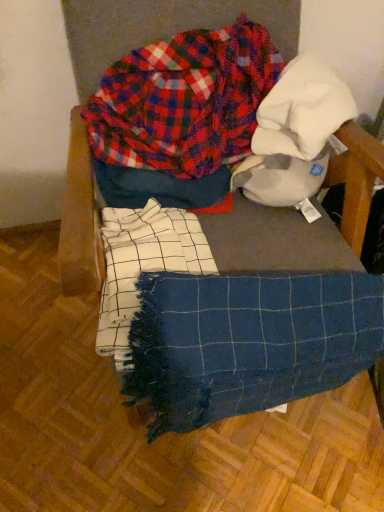
Question: Should I look upward or downward to see plaid fabric at upper center?

Choices:
 (A) up
 (B) down

Answer: (A)

Question: Does blue woven blanket at center have a larger size compared to blue woven blanket at center?

Choices:
 (A) no
 (B) yes

Answer: (A)

Question: Is blue woven blanket at center at the right side of blue woven blanket at center?

Choices:
 (A) yes
 (B) no

Answer: (A)

Question: Is blue woven blanket at center positioned behind blue woven blanket at center?

Choices:
 (A) yes
 (B) no

Answer: (A)

Question: Could blue woven blanket at center be considered to be inside blue woven blanket at center?

Choices:
 (A) no
 (B) yes

Answer: (A)

Question: From the image's perspective, would you say blue woven blanket at center is shown under blue woven blanket at center?

Choices:
 (A) yes
 (B) no

Answer: (A)

Question: Does blue woven blanket at center turn towards blue woven blanket at center?

Choices:
 (A) yes
 (B) no

Answer: (B)

Question: From a real-world perspective, is blue woven blanket at center beneath blue woven blanket at center?

Choices:
 (A) no
 (B) yes

Answer: (A)

Question: Can you confirm if blue woven blanket at center is thinner than blue woven blanket at center?

Choices:
 (A) yes
 (B) no

Answer: (B)

Question: Is blue woven blanket at center further to the viewer compared to blue woven blanket at center?

Choices:
 (A) no
 (B) yes

Answer: (A)

Question: From a real-world perspective, does blue woven blanket at center stand above blue woven blanket at center?

Choices:
 (A) no
 (B) yes

Answer: (B)

Question: Can you confirm if blue woven blanket at center is positioned to the left of blue woven blanket at center?

Choices:
 (A) no
 (B) yes

Answer: (B)

Question: From the image's perspective, is blue woven blanket at center on blue woven blanket at center?

Choices:
 (A) no
 (B) yes

Answer: (B)

Question: Considering the relative positions of plaid fabric at upper center and blue woven blanket at center in the image provided, is plaid fabric at upper center to the left of blue woven blanket at center from the viewer's perspective?

Choices:
 (A) yes
 (B) no

Answer: (A)